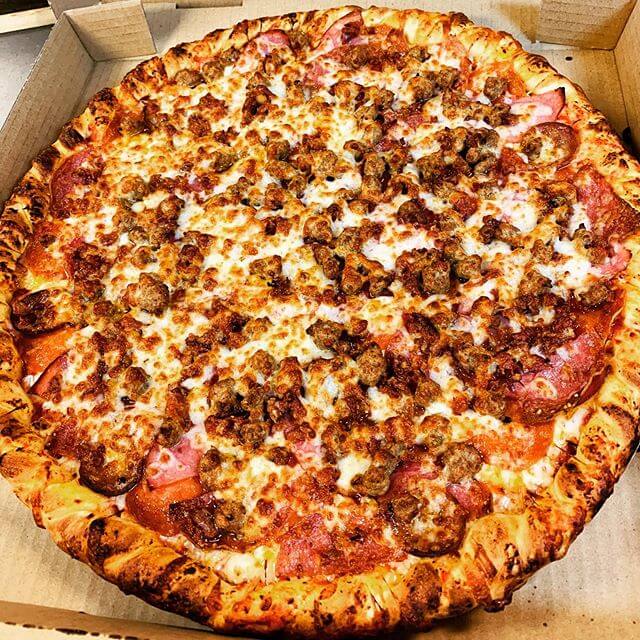
At what (x,y) coordinates should I click in order to perform the action: click on pizza box. Please return your answer as a coordinate pair (x, y). Image resolution: width=640 pixels, height=640 pixels. Looking at the image, I should click on (592, 73).